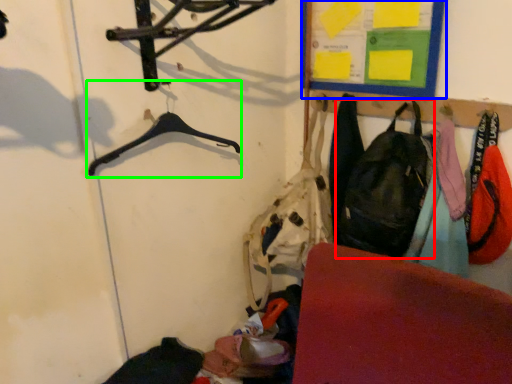
Question: Which object is positioned farthest from shoulder bag (highlighted by a red box)? Select from bulletin board (highlighted by a blue box) and hanger (highlighted by a green box).

Choices:
 (A) bulletin board
 (B) hanger

Answer: (B)